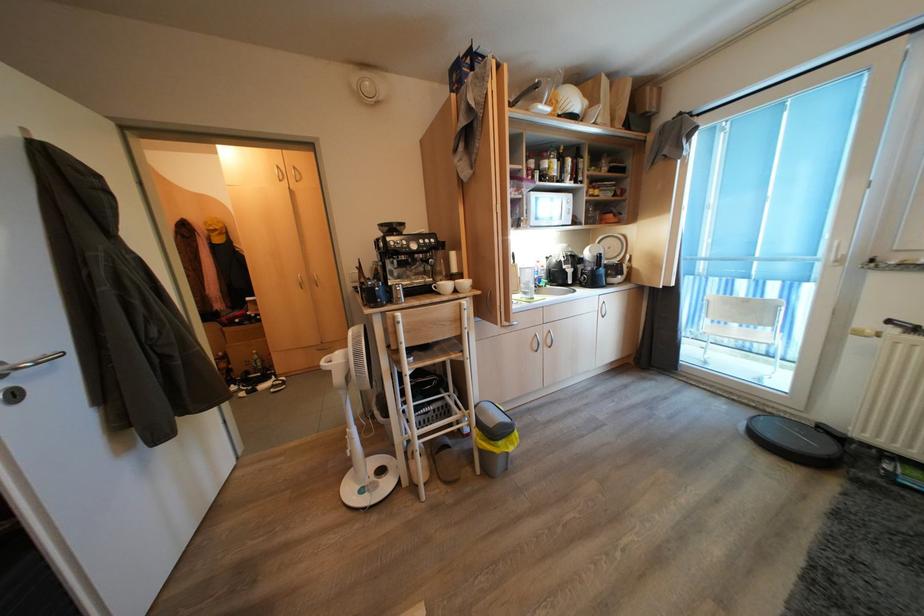
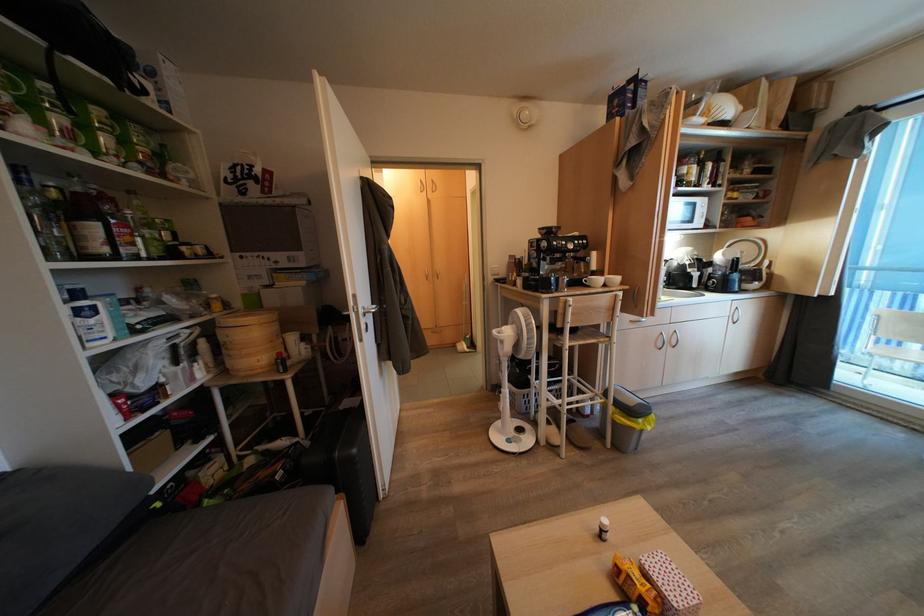
What movement of the cameraman would produce the second image?

The cameraman walked toward left, backward.